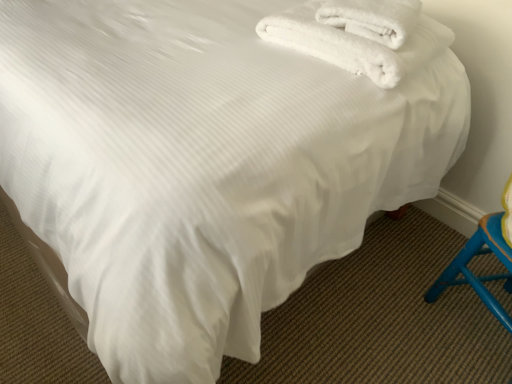
Question: Is point (358, 18) positioned closer to the camera than point (402, 51)?

Choices:
 (A) farther
 (B) closer

Answer: (A)

Question: From the image's perspective, relative to white fluffy towels at upper right, the 1th towel in the left-to-right sequence, is white fluffy towel at upper right, which is the second towel from left to right, above or below?

Choices:
 (A) above
 (B) below

Answer: (A)

Question: In terms of width, does white fluffy towel at upper right, which is the first towel in right-to-left order, look wider or thinner when compared to white fluffy towels at upper right, the 1th towel in the left-to-right sequence?

Choices:
 (A) thin
 (B) wide

Answer: (A)

Question: Is white fluffy towels at upper right, positioned as the second towel in right-to-left order, situated inside white fluffy towel at upper right, which is the first towel in right-to-left order, or outside?

Choices:
 (A) outside
 (B) inside

Answer: (A)

Question: Is point (297, 44) positioned closer to the camera than point (338, 13)?

Choices:
 (A) farther
 (B) closer

Answer: (A)

Question: Is white fluffy towels at upper right, the 1th towel in the left-to-right sequence, to the left or to the right of white fluffy towel at upper right, which is the first towel in right-to-left order, in the image?

Choices:
 (A) left
 (B) right

Answer: (A)

Question: Considering the positions of white fluffy towels at upper right, the 1th towel in the left-to-right sequence, and white fluffy towel at upper right, which is the first towel in right-to-left order, in the image, is white fluffy towels at upper right, the 1th towel in the left-to-right sequence, bigger or smaller than white fluffy towel at upper right, which is the first towel in right-to-left order,?

Choices:
 (A) big
 (B) small

Answer: (A)